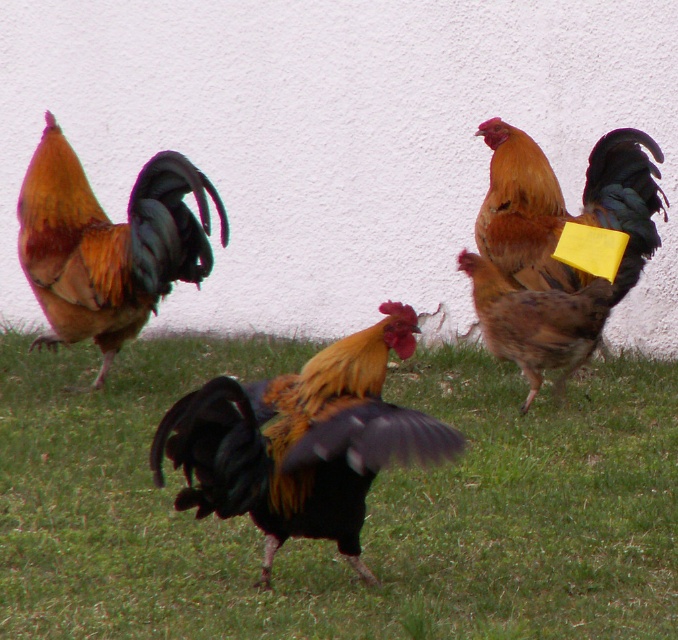
Question: Does shiny orange feathers at left come in front of golden brown feathers at center?

Choices:
 (A) no
 (B) yes

Answer: (B)

Question: Which point is closer to the camera taking this photo?

Choices:
 (A) (517, 262)
 (B) (574, 586)
 (C) (266, 438)

Answer: (C)

Question: Which of the following is the farthest from the observer?

Choices:
 (A) golden brown feathers at center
 (B) shiny black rooster at center
 (C) shiny orange feathers at left

Answer: (A)

Question: Is green grass at center wider than shiny orange feathers at left?

Choices:
 (A) no
 (B) yes

Answer: (B)

Question: Which point is farther to the camera?

Choices:
 (A) golden brown feathers at center
 (B) shiny orange feathers at left

Answer: (A)

Question: Is green grass at center above shiny orange feathers at left?

Choices:
 (A) no
 (B) yes

Answer: (A)